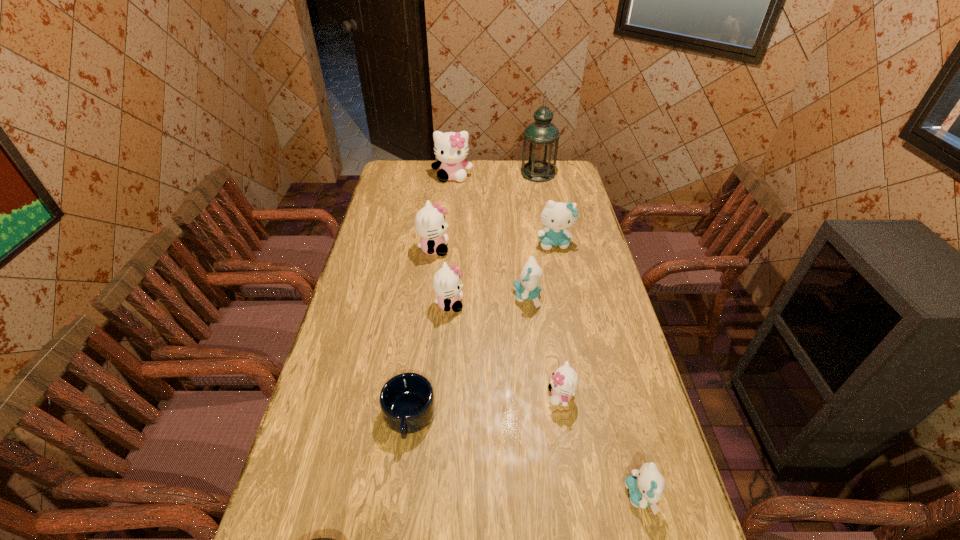
This screenshot has width=960, height=540. I want to click on green oil lamp, so click(541, 138).

Identify the location of oil lamp. Image resolution: width=960 pixels, height=540 pixels. (541, 138).

Locate an element on the screen. The image size is (960, 540). the farthest white kitten is located at coordinates (451, 148).

Identify the location of the tallest kitten. (451, 148).

Locate an element on the screen. This screenshot has width=960, height=540. the second biggest white kitten is located at coordinates (430, 224).

This screenshot has height=540, width=960. Identify the location of the biggest blue kitten. (557, 216).

Locate an element on the screen. The height and width of the screenshot is (540, 960). the leftmost blue kitten is located at coordinates (528, 288).

You are a GUI agent. You are given a task and a screenshot of the screen. Output one action in this format:
    pyautogui.click(x=<x>, y=<y>)
    Task: Click on the second nearest blue kitten
    
    Given the screenshot: What is the action you would take?
    pyautogui.click(x=528, y=288)

The width and height of the screenshot is (960, 540). I want to click on the third farthest white kitten, so click(447, 284).

Find the location of a particular element. the second nearest kitten is located at coordinates (564, 381).